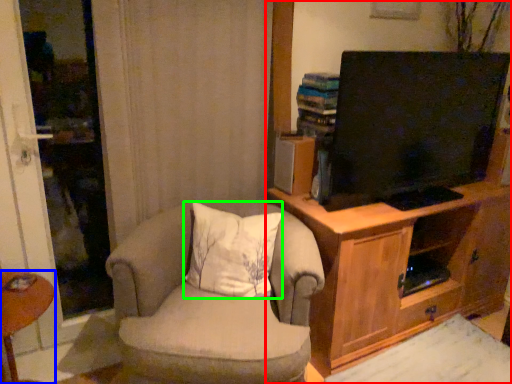
Question: Based on their relative distances, which object is nearer to cabinetry (highlighted by a red box)? Choose from desk (highlighted by a blue box) and pillow (highlighted by a green box).

Choices:
 (A) desk
 (B) pillow

Answer: (B)